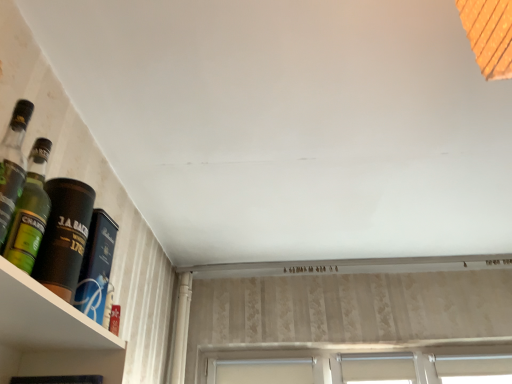
What do you see at coordinates (30, 211) in the screenshot? This screenshot has width=512, height=384. I see `green glass bottle at left, marked as the 3th bottle in a back-to-front arrangement` at bounding box center [30, 211].

What do you see at coordinates (64, 236) in the screenshot? I see `green glass bottle at left, which is counted as the second bottle, starting from the back` at bounding box center [64, 236].

You are a GUI agent. You are given a task and a screenshot of the screen. Output one action in this format:
    pyautogui.click(x=<x>, y=<y>)
    Task: Click on the green glass bottle at left, marked as the 3th bottle in a back-to-front arrangement
    This screenshot has height=384, width=512.
    Given the screenshot: What is the action you would take?
    pyautogui.click(x=30, y=211)

Between green glass bottle at left, which is counted as the second bottle, starting from the back, and green glass bottle at left, marked as the 3th bottle in a back-to-front arrangement, which one has smaller size?

With smaller size is green glass bottle at left, marked as the 3th bottle in a back-to-front arrangement.

Consider the image. Does green glass bottle at left, arranged as the second bottle when viewed from the front, have a greater width compared to green glass bottle at left, marked as the 3th bottle in a back-to-front arrangement?

Yes.

How many degrees apart are the facing directions of green glass bottle at left, which is counted as the second bottle, starting from the back, and green glass bottle at left, marked as the 3th bottle in a back-to-front arrangement?

They differ by 1.67 degrees in their facing directions.

Would you say green glass bottle at left, positioned as the 1th bottle in front-to-back order, is part of green glass bottle at left, which is counted as the second bottle, starting from the back,'s contents?

No, green glass bottle at left, positioned as the 1th bottle in front-to-back order, is located outside of green glass bottle at left, which is counted as the second bottle, starting from the back.

Is white plastic window at center, marked as the first window in a left-to-right arrangement, shorter than white fabric window at lower right, which is the third window in left-to-right order?

Incorrect, the height of white plastic window at center, marked as the first window in a left-to-right arrangement, does not fall short of that of white fabric window at lower right, which is the third window in left-to-right order.

Is white plastic window at center, which ranks as the 3th window in right-to-left order, positioned with its back to white fabric window at lower right, which is the third window in left-to-right order?

white plastic window at center, which ranks as the 3th window in right-to-left order, does not have its back to white fabric window at lower right, which is the third window in left-to-right order.

How much distance is there between white plastic window at center, which ranks as the 3th window in right-to-left order, and white fabric window at lower right, which appears as the 1th window when viewed from the right?

white plastic window at center, which ranks as the 3th window in right-to-left order, is 35.54 inches from white fabric window at lower right, which appears as the 1th window when viewed from the right.

Does white fabric window at lower center, which is the second window in left-to-right order, have a larger size compared to green glass bottle at left, positioned as the 1th bottle in front-to-back order?

Indeed, white fabric window at lower center, which is the second window in left-to-right order, has a larger size compared to green glass bottle at left, positioned as the 1th bottle in front-to-back order.

Looking at this image, from their relative heights in the image, would you say white fabric window at lower center, which is the second window in left-to-right order, is taller or shorter than green glass bottle at left, positioned as the 1th bottle in front-to-back order?

white fabric window at lower center, which is the second window in left-to-right order, is shorter than green glass bottle at left, positioned as the 1th bottle in front-to-back order.

From a real-world perspective, is white fabric window at lower center, which is the second window in left-to-right order, physically below green glass bottle at left, positioned as the 1th bottle in front-to-back order?

No, from a real-world perspective, white fabric window at lower center, which is the second window in left-to-right order, is not beneath green glass bottle at left, positioned as the 1th bottle in front-to-back order.

Image resolution: width=512 pixels, height=384 pixels. Identify the location of the 1st window behind the green glass bottle at left, marked as the 3th bottle in a back-to-front arrangement, counting from the anchor's position. (377, 366).

Is white fabric window at lower center, which is the second window in left-to-right order, taller than white plastic window at center, which ranks as the 3th window in right-to-left order?

Indeed, white fabric window at lower center, which is the second window in left-to-right order, has a greater height compared to white plastic window at center, which ranks as the 3th window in right-to-left order.

Is white fabric window at lower center, the second window viewed from the right, far away from white plastic window at center, which ranks as the 3th window in right-to-left order?

white fabric window at lower center, the second window viewed from the right, is actually quite close to white plastic window at center, which ranks as the 3th window in right-to-left order.

Does dark brown leather bottle at left, the 1th bottle viewed from the back, come in front of white fabric window at lower right, which appears as the 1th window when viewed from the right?

Yes, it is in front of white fabric window at lower right, which appears as the 1th window when viewed from the right.

Which object is wider, dark brown leather bottle at left, which appears as the 3th bottle when viewed from the front, or white fabric window at lower right, which is the third window in left-to-right order?

Wider between the two is dark brown leather bottle at left, which appears as the 3th bottle when viewed from the front.

Is dark brown leather bottle at left, which appears as the 3th bottle when viewed from the front, not within white fabric window at lower right, which appears as the 1th window when viewed from the right?

Yes, dark brown leather bottle at left, which appears as the 3th bottle when viewed from the front, is not within white fabric window at lower right, which appears as the 1th window when viewed from the right.

At what (x,y) coordinates should I click in order to perform the action: click on the 1st bottle above the white fabric window at lower right, which appears as the 1th window when viewed from the right (from the image's perspective). Please return your answer as a coordinate pair (x, y). This screenshot has height=384, width=512. Looking at the image, I should click on (96, 266).

Can we say white fabric window at lower center, which is the second window in left-to-right order, lies outside green glass bottle at left, arranged as the second bottle when viewed from the front?

white fabric window at lower center, which is the second window in left-to-right order, is positioned outside green glass bottle at left, arranged as the second bottle when viewed from the front.

From the image's perspective, does white fabric window at lower center, which is the second window in left-to-right order, appear higher than green glass bottle at left, arranged as the second bottle when viewed from the front?

Incorrect, from the image's perspective, white fabric window at lower center, which is the second window in left-to-right order, is lower than green glass bottle at left, arranged as the second bottle when viewed from the front.

Which is behind, white fabric window at lower center, which is the second window in left-to-right order, or green glass bottle at left, arranged as the second bottle when viewed from the front?

white fabric window at lower center, which is the second window in left-to-right order, is further from the camera.

Are white fabric window at lower center, the second window viewed from the right, and green glass bottle at left, arranged as the second bottle when viewed from the front, making contact?

They are not placed beside each other.

Can you confirm if white plastic window at center, marked as the first window in a left-to-right arrangement, is shorter than dark brown leather bottle at left, which appears as the 3th bottle when viewed from the front?

Yes.

Is white plastic window at center, which ranks as the 3th window in right-to-left order, far from dark brown leather bottle at left, the 1th bottle viewed from the back?

Yes, white plastic window at center, which ranks as the 3th window in right-to-left order, is far from dark brown leather bottle at left, the 1th bottle viewed from the back.

Where is `the 2nd bottle below the white plastic window at center, marked as the first window in a left-to-right arrangement (from a real-world perspective)`? The height and width of the screenshot is (384, 512). the 2nd bottle below the white plastic window at center, marked as the first window in a left-to-right arrangement (from a real-world perspective) is located at coordinates (96, 266).

Is point (251, 377) positioned in front of point (102, 259)?

No, it is not.

From the image's perspective, count 1st bottles downward from the green glass bottle at left, positioned as the 1th bottle in front-to-back order, and point to it. Please provide its 2D coordinates.

[(64, 236)]

From the white fabric window at lower right, which is the third window in left-to-right order, count the 2nd window to the left and point to it. Please provide its 2D coordinates.

[(261, 371)]

When comparing their distances from white plastic window at center, marked as the first window in a left-to-right arrangement, does green glass bottle at left, marked as the 3th bottle in a back-to-front arrangement, or dark brown leather bottle at left, which appears as the 3th bottle when viewed from the front, seem closer?

dark brown leather bottle at left, which appears as the 3th bottle when viewed from the front, is positioned closer to the anchor white plastic window at center, marked as the first window in a left-to-right arrangement.

Which object lies further to the anchor point green glass bottle at left, marked as the 3th bottle in a back-to-front arrangement, green glass bottle at left, which is counted as the second bottle, starting from the back, or white fabric window at lower center, which is the second window in left-to-right order?

white fabric window at lower center, which is the second window in left-to-right order, is further to green glass bottle at left, marked as the 3th bottle in a back-to-front arrangement.

Consider the image. Considering their positions, is white fabric window at lower right, which appears as the 1th window when viewed from the right, positioned further to dark brown leather bottle at left, the 1th bottle viewed from the back, than white plastic window at center, which ranks as the 3th window in right-to-left order?

white fabric window at lower right, which appears as the 1th window when viewed from the right, is further to dark brown leather bottle at left, the 1th bottle viewed from the back.

From the picture: Based on their spatial positions, is white fabric window at lower center, which is the second window in left-to-right order, or white plastic window at center, which ranks as the 3th window in right-to-left order, closer to white fabric window at lower right, which appears as the 1th window when viewed from the right?

The object closer to white fabric window at lower right, which appears as the 1th window when viewed from the right, is white fabric window at lower center, which is the second window in left-to-right order.

From the image, which object appears to be nearer to white fabric window at lower center, the second window viewed from the right, green glass bottle at left, which is counted as the second bottle, starting from the back, or white plastic window at center, which ranks as the 3th window in right-to-left order?

The object closer to white fabric window at lower center, the second window viewed from the right, is white plastic window at center, which ranks as the 3th window in right-to-left order.

Considering their positions, is white fabric window at lower right, which appears as the 1th window when viewed from the right, positioned closer to white plastic window at center, marked as the first window in a left-to-right arrangement, than green glass bottle at left, which is counted as the second bottle, starting from the back?

Among the two, white fabric window at lower right, which appears as the 1th window when viewed from the right, is located nearer to white plastic window at center, marked as the first window in a left-to-right arrangement.

Estimate the real-world distances between objects in this image. Which object is closer to green glass bottle at left, arranged as the second bottle when viewed from the front, white fabric window at lower right, which is the third window in left-to-right order, or white plastic window at center, which ranks as the 3th window in right-to-left order?

white plastic window at center, which ranks as the 3th window in right-to-left order, is closer to green glass bottle at left, arranged as the second bottle when viewed from the front.

When comparing their distances from green glass bottle at left, arranged as the second bottle when viewed from the front, does white fabric window at lower right, which appears as the 1th window when viewed from the right, or white fabric window at lower center, which is the second window in left-to-right order, seem further?

white fabric window at lower right, which appears as the 1th window when viewed from the right.

Locate an element on the screen. This screenshot has width=512, height=384. window between dark brown leather bottle at left, which appears as the 3th bottle when viewed from the front, and white fabric window at lower right, which is the third window in left-to-right order, from front to back is located at coordinates (377, 366).

You are a GUI agent. You are given a task and a screenshot of the screen. Output one action in this format:
    pyautogui.click(x=<x>, y=<y>)
    Task: Click on the bottle between green glass bottle at left, positioned as the 1th bottle in front-to-back order, and dark brown leather bottle at left, which appears as the 3th bottle when viewed from the front, in the front-back direction
    The height and width of the screenshot is (384, 512).
    Given the screenshot: What is the action you would take?
    pyautogui.click(x=64, y=236)

Where is `bottle between green glass bottle at left, which is counted as the second bottle, starting from the back, and white plastic window at center, which ranks as the 3th window in right-to-left order, from front to back`? The height and width of the screenshot is (384, 512). bottle between green glass bottle at left, which is counted as the second bottle, starting from the back, and white plastic window at center, which ranks as the 3th window in right-to-left order, from front to back is located at coordinates point(96,266).

This screenshot has height=384, width=512. Find the location of `bottle between green glass bottle at left, arranged as the second bottle when viewed from the front, and white fabric window at lower center, the second window viewed from the right, in the front-back direction`. bottle between green glass bottle at left, arranged as the second bottle when viewed from the front, and white fabric window at lower center, the second window viewed from the right, in the front-back direction is located at coordinates (96, 266).